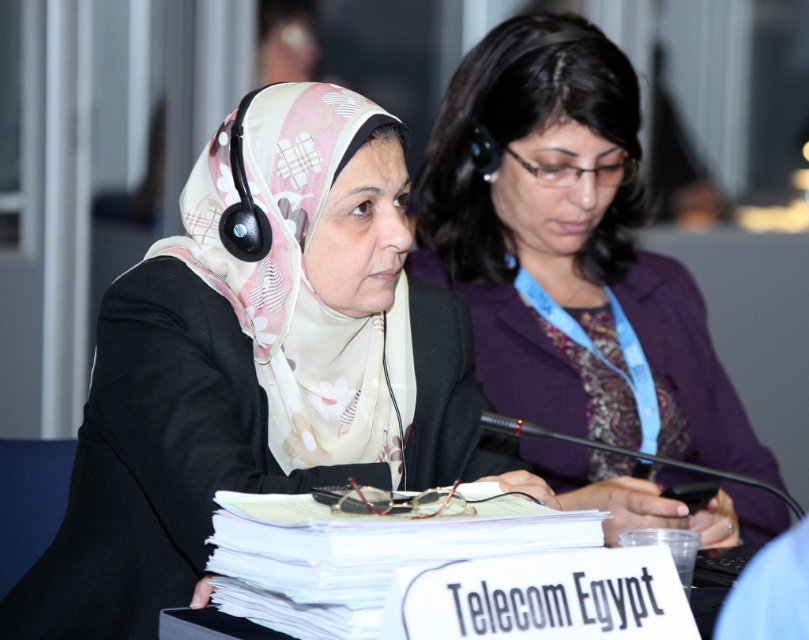
You are a stagehand preparing to adjust the camera position for a live event. The camera needs to be positioned exactly 4 feet away from the matte black suit at center to ensure proper framing. Based on the current setup, is the camera within the required distance?

The matte black suit at center and camera are 3.95 feet apart, which is within the 4 feet requirement. The camera is already positioned correctly.

You are a photographer positioned at the front of the room. You want to take a photo of both the matte black suit at center and the purple fabric jacket at center. Which one will appear larger in your photo?

The matte black suit at center will appear larger in the photo because it is closer to the viewer than the purple fabric jacket at center.

You are an event organizer arranging seating for a conference. You need to ensure that the person in the purple fabric jacket at center has a clear view of the speaker in the matte black suit at center. Based on their positions, is this possible?

The matte black suit at center is located below the purple fabric jacket at center, so the person in the purple fabric jacket at center would have a clear view of the speaker in the matte black suit at center since they are seated behind and above them.